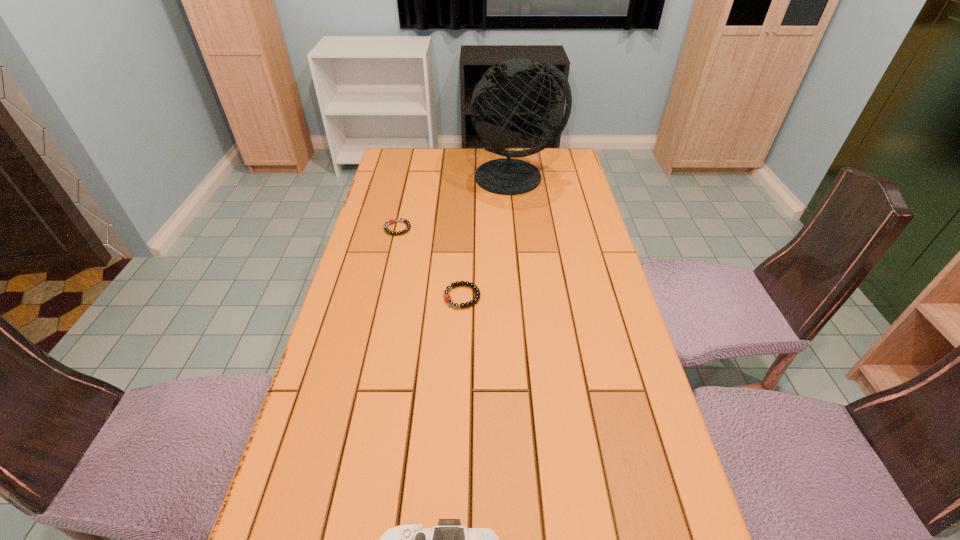
You are a GUI agent. You are given a task and a screenshot of the screen. Output one action in this format:
    pyautogui.click(x=<x>, y=<y>)
    Task: Click on the farthest object
    The width and height of the screenshot is (960, 540).
    Given the screenshot: What is the action you would take?
    pyautogui.click(x=496, y=94)

Where is `the tallest object`? the tallest object is located at coordinates (496, 94).

Locate an element on the screen. The image size is (960, 540). the right bracelet is located at coordinates (447, 297).

The width and height of the screenshot is (960, 540). Identify the location of the nearer bracelet. (447, 297).

Locate an element on the screen. Image resolution: width=960 pixels, height=540 pixels. the left bracelet is located at coordinates (391, 221).

Identify the location of the leftmost object. pos(391,221).

The height and width of the screenshot is (540, 960). I want to click on vacant space located on the front-facing side of the tallest object, so click(x=523, y=237).

Where is `vacant space located on the right of the nearer bracelet`? Image resolution: width=960 pixels, height=540 pixels. vacant space located on the right of the nearer bracelet is located at coordinates (608, 296).

The height and width of the screenshot is (540, 960). I want to click on vacant space located 0.250m on the back of the leftmost object, so click(408, 181).

At what (x,y) coordinates should I click in order to perform the action: click on object located at the far edge. Please return your answer as a coordinate pair (x, y). The image size is (960, 540). Looking at the image, I should click on pos(496,94).